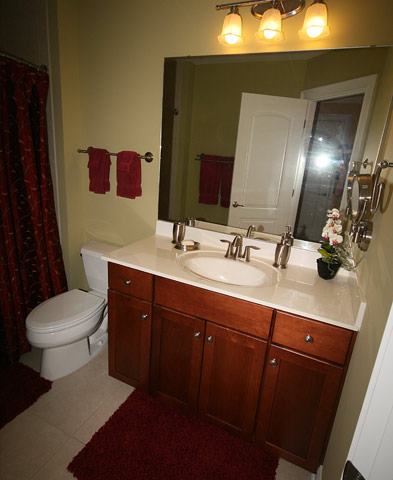
Find the location of a particular element. The height and width of the screenshot is (480, 393). faucet is located at coordinates (236, 251).